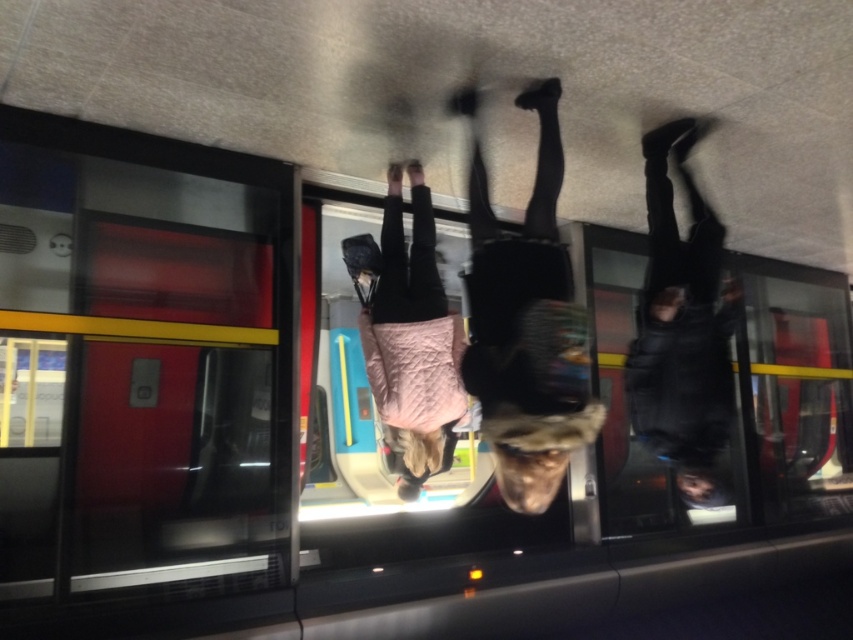
Question: Can you confirm if black leather pants at center is thinner than pink quilted jacket at center?

Choices:
 (A) yes
 (B) no

Answer: (B)

Question: Which object is farther from the camera taking this photo?

Choices:
 (A) black leather pants at center
 (B) pink quilted jacket at center

Answer: (B)

Question: Which of these objects is positioned farthest from the pink quilted jacket at center?

Choices:
 (A) black leather pants at center
 (B) black leather pants at upper center

Answer: (B)

Question: Is black leather pants at upper center smaller than pink quilted jacket at center?

Choices:
 (A) yes
 (B) no

Answer: (A)

Question: Which point is closer to the camera?

Choices:
 (A) black leather pants at center
 (B) pink quilted jacket at center

Answer: (A)

Question: Does black leather pants at upper center appear under pink quilted jacket at center?

Choices:
 (A) yes
 (B) no

Answer: (B)